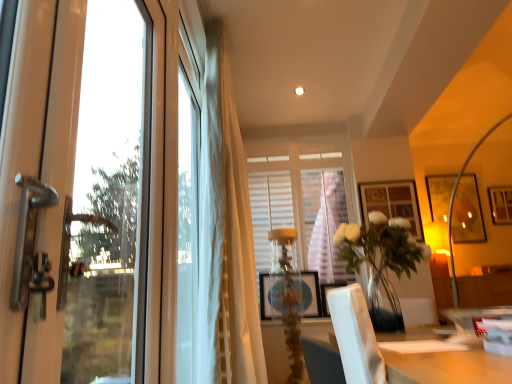
Question: Which direction should I rotate to look at matte wooden picture frame at center, the 5th picture frame from the right?

Choices:
 (A) left
 (B) right

Answer: (B)

Question: From a real-world perspective, does wooden picture frame at upper right, which is counted as the first picture frame, starting from the right, sit lower than white sheer curtain at center?

Choices:
 (A) no
 (B) yes

Answer: (A)

Question: Is wooden picture frame at upper right, which is the first picture frame from back to front, turned away from white sheer curtain at center?

Choices:
 (A) no
 (B) yes

Answer: (A)

Question: Could you tell me if wooden picture frame at upper right, which is the first picture frame from back to front, is facing white sheer curtain at center?

Choices:
 (A) yes
 (B) no

Answer: (B)

Question: Is wooden picture frame at upper right, which is the fifth picture frame from left to right, at the right side of white sheer curtain at center?

Choices:
 (A) no
 (B) yes

Answer: (B)

Question: Is wooden picture frame at upper right, which ranks as the 5th picture frame in front-to-back order, positioned beyond the bounds of white sheer curtain at center?

Choices:
 (A) yes
 (B) no

Answer: (A)

Question: Considering the relative sizes of wooden picture frame at upper right, which is counted as the first picture frame, starting from the right, and white sheer curtain at center in the image provided, is wooden picture frame at upper right, which is counted as the first picture frame, starting from the right, bigger than white sheer curtain at center?

Choices:
 (A) yes
 (B) no

Answer: (B)

Question: Could you tell me if transparent glass window screen at left is facing translucent glass table lamp at center?

Choices:
 (A) yes
 (B) no

Answer: (B)

Question: From the image's perspective, is transparent glass window screen at left over translucent glass table lamp at center?

Choices:
 (A) yes
 (B) no

Answer: (A)

Question: Is transparent glass window screen at left next to translucent glass table lamp at center and touching it?

Choices:
 (A) yes
 (B) no

Answer: (B)

Question: Is transparent glass window screen at left thinner than translucent glass table lamp at center?

Choices:
 (A) no
 (B) yes

Answer: (B)

Question: Does transparent glass window screen at left have a lesser height compared to translucent glass table lamp at center?

Choices:
 (A) yes
 (B) no

Answer: (B)

Question: From a real-world perspective, is transparent glass window screen at left below translucent glass table lamp at center?

Choices:
 (A) no
 (B) yes

Answer: (A)

Question: Is matte wooden picture frame at center, acting as the second picture frame starting from the front, smaller than clear glass door at left, the first window positioned from the left?

Choices:
 (A) yes
 (B) no

Answer: (A)